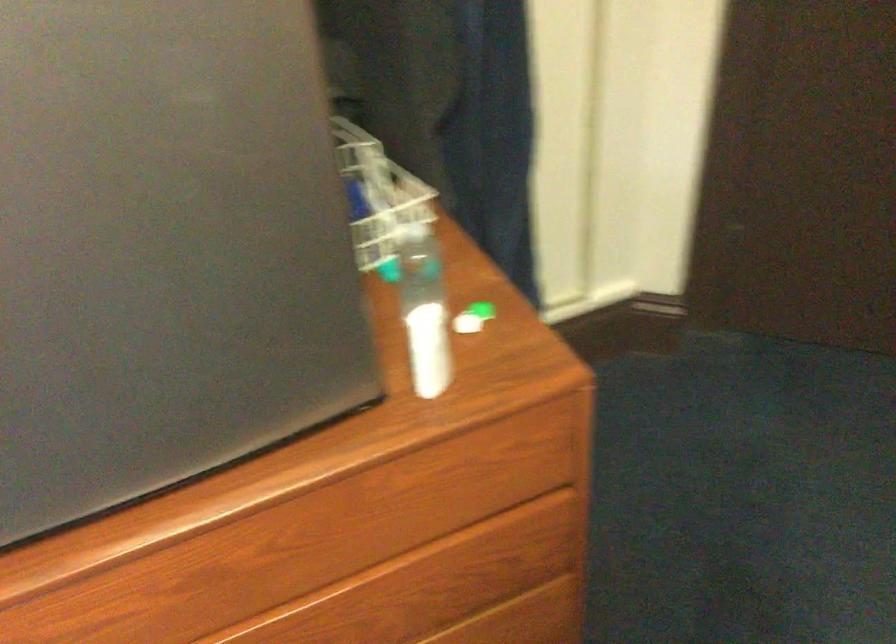
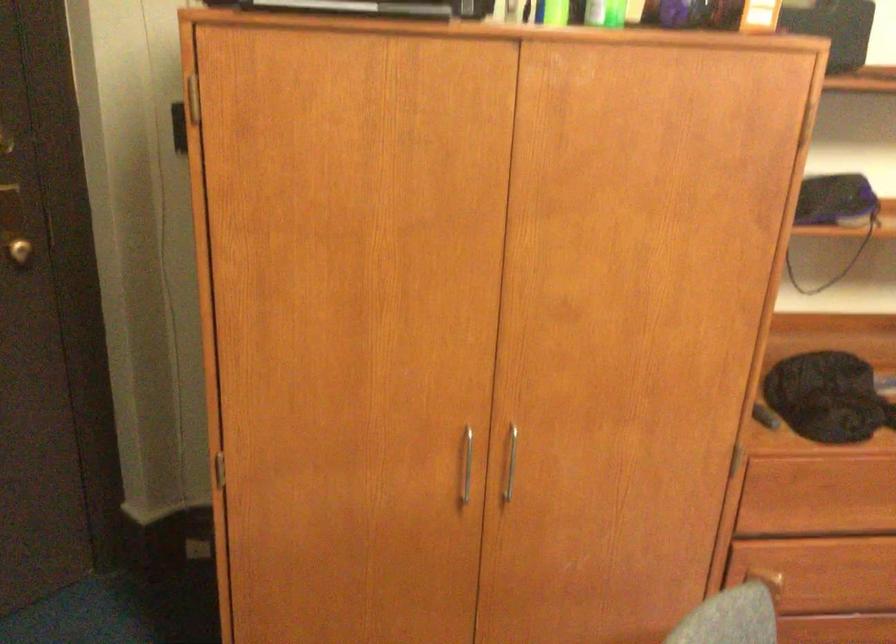
Question: How did the camera likely rotate?

Choices:
 (A) Left
 (B) Right
 (C) Up
 (D) Down

Answer: (B)